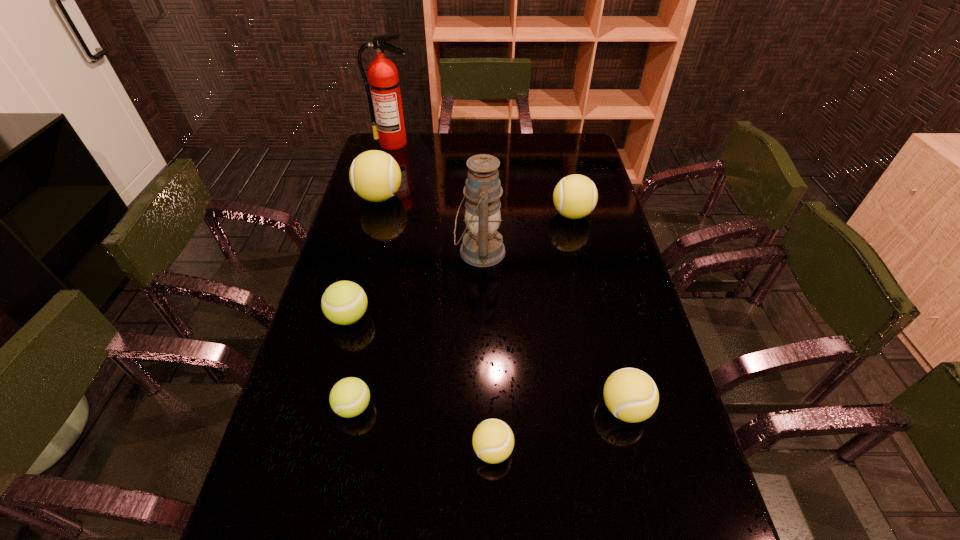
The width and height of the screenshot is (960, 540). In order to click on free area in between the smaller green tennis ball and the fire extinguisher in this screenshot , I will do `click(373, 275)`.

What are the coordinates of `vacant point located between the fifth shortest object and the third tennis ball from right to left` in the screenshot? It's located at (533, 332).

Locate an element on the screen. This screenshot has height=540, width=960. vacant point located between the sixth shortest object and the fifth nearest object is located at coordinates (430, 225).

At what (x,y) coordinates should I click in order to perform the action: click on empty space that is in between the smallest yellow tennis ball and the nearer green tennis ball. Please return your answer as a coordinate pair (x, y). The width and height of the screenshot is (960, 540). Looking at the image, I should click on (423, 428).

Find the location of a particular element. This screenshot has width=960, height=540. blank region between the oil lamp and the tallest object is located at coordinates (437, 198).

Locate an element on the screen. The image size is (960, 540). free space between the third biggest yellow tennis ball and the third smallest yellow tennis ball is located at coordinates (598, 311).

Identify the location of vacant space in between the fifth shortest object and the second smallest yellow tennis ball. (598, 311).

Locate an element on the screen. The height and width of the screenshot is (540, 960). vacant space that is in between the farther green tennis ball and the smaller green tennis ball is located at coordinates (351, 362).

You are a GUI agent. You are given a task and a screenshot of the screen. Output one action in this format:
    pyautogui.click(x=<x>, y=<y>)
    Task: Click on the free point between the leftmost yellow tennis ball and the fourth farthest object
    
    Given the screenshot: What is the action you would take?
    pyautogui.click(x=430, y=225)

At what (x,y) coordinates should I click in order to perform the action: click on free spot between the third tennis ball from right to left and the fifth shortest tennis ball. Please return your answer as a coordinate pair (x, y). Image resolution: width=960 pixels, height=540 pixels. Looking at the image, I should click on (533, 332).